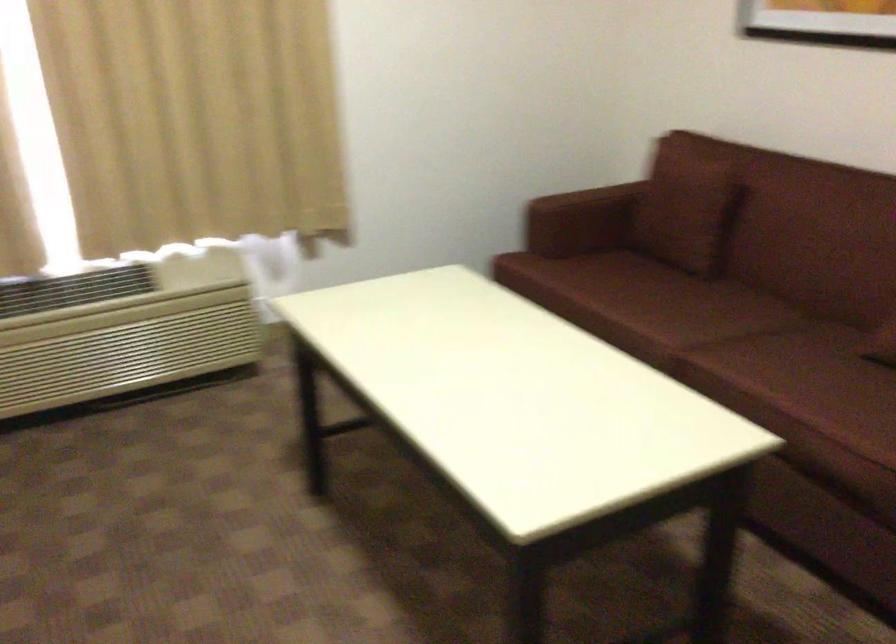
Where would you sit the red sofa sitting surface? Please return your answer as a coordinate pair (x, y).

(682, 310)